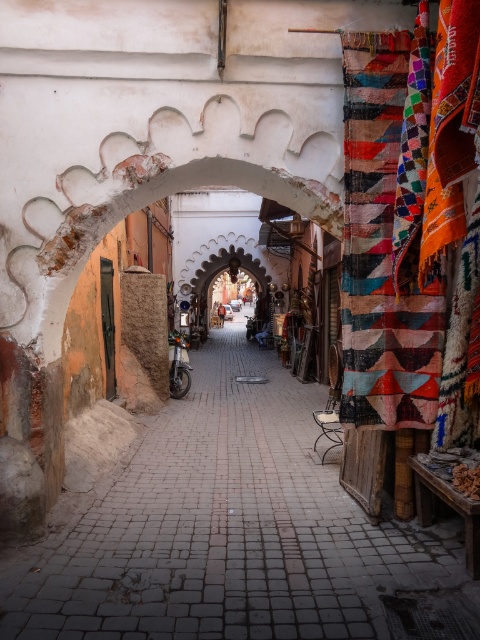
Can you confirm if brick paved alley at center is smaller than multicolored woven rug at right?

No.

Looking at this image, is brick paved alley at center shorter than multicolored woven rug at right?

Correct, brick paved alley at center is not as tall as multicolored woven rug at right.

Who is more forward, (327, 472) or (384, 144)?

Positioned in front is point (384, 144).

I want to click on brick paved alley at center, so click(233, 531).

Is brick paved alley at center further to camera compared to silver metallic motorcycle at center?

No, brick paved alley at center is in front of silver metallic motorcycle at center.

Can you confirm if brick paved alley at center is bigger than silver metallic motorcycle at center?

Yes.

Is point (11, 588) positioned before point (175, 374)?

Yes, point (11, 588) is in front of point (175, 374).

At what (x,y) coordinates should I click in order to perform the action: click on brick paved alley at center. Please return your answer as a coordinate pair (x, y). Image resolution: width=480 pixels, height=640 pixels. Looking at the image, I should click on (233, 531).

Who is more forward, (437, 346) or (172, 339)?

Point (437, 346)

Who is more distant from viewer, (451, 188) or (173, 356)?

The point (173, 356) is more distant.

The width and height of the screenshot is (480, 640). What are the coordinates of `multicolored woven rug at right` in the screenshot? It's located at (387, 236).